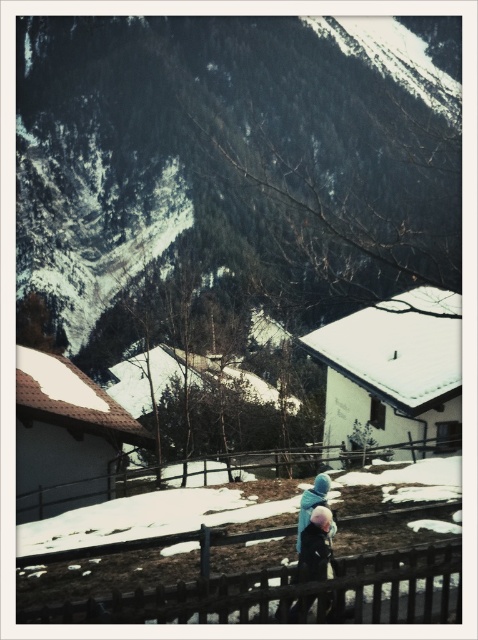
Question: Which of these objects is positioned farthest from the brown wooden fence at lower center?

Choices:
 (A) wooden at lower center
 (B) dark blue fabric coat at center
 (C) snowy forested mountain at upper center
 (D) light blue fabric at center

Answer: (C)

Question: Among these points, which one is farthest from the camera?

Choices:
 (A) (311, 531)
 (B) (300, 234)
 (C) (160, 609)

Answer: (B)

Question: Which point is farther to the camera?

Choices:
 (A) (54, 49)
 (B) (321, 573)
 (C) (65, 492)
 (D) (166, 614)

Answer: (A)

Question: Is brown wooden fence at lower center below dark blue fabric coat at center?

Choices:
 (A) yes
 (B) no

Answer: (A)

Question: Can you confirm if brown wooden fence at lower center is positioned to the right of light blue fabric at center?

Choices:
 (A) yes
 (B) no

Answer: (B)

Question: Does dark blue fabric coat at center appear on the left side of light blue fabric at center?

Choices:
 (A) no
 (B) yes

Answer: (B)